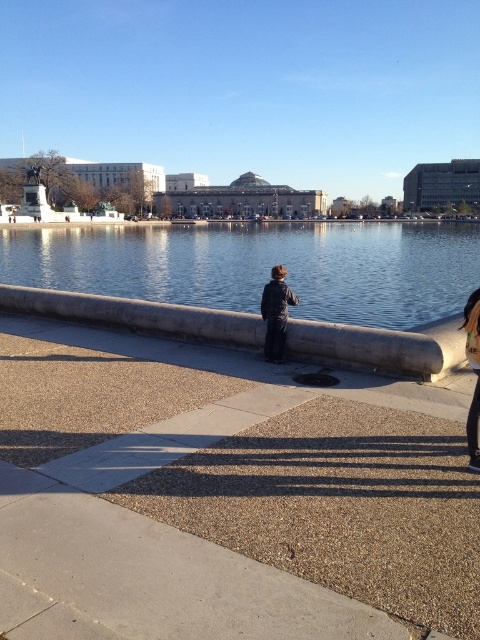
You are standing at the point marked by the coordinates [226,496] in the image. What object are you standing on?

You are standing on the gray concrete pavement at center located at point [226,496].

You are a delivery robot that needs to cross from the gray concrete pavement at center to the clear water at center. Can you safely traverse the path between them?

The gray concrete pavement at center has a lesser width compared to clear water at center. Since the clear water at center is wider, the robot can safely traverse the path between them as the width is sufficient for passage.